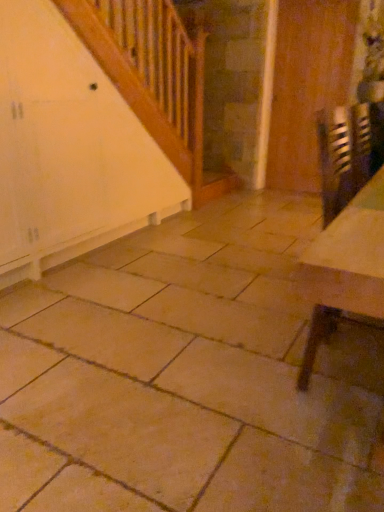
The width and height of the screenshot is (384, 512). Find the location of `vacant space situated on the left part of metallic reflective table at lower right`. vacant space situated on the left part of metallic reflective table at lower right is located at coordinates (244, 377).